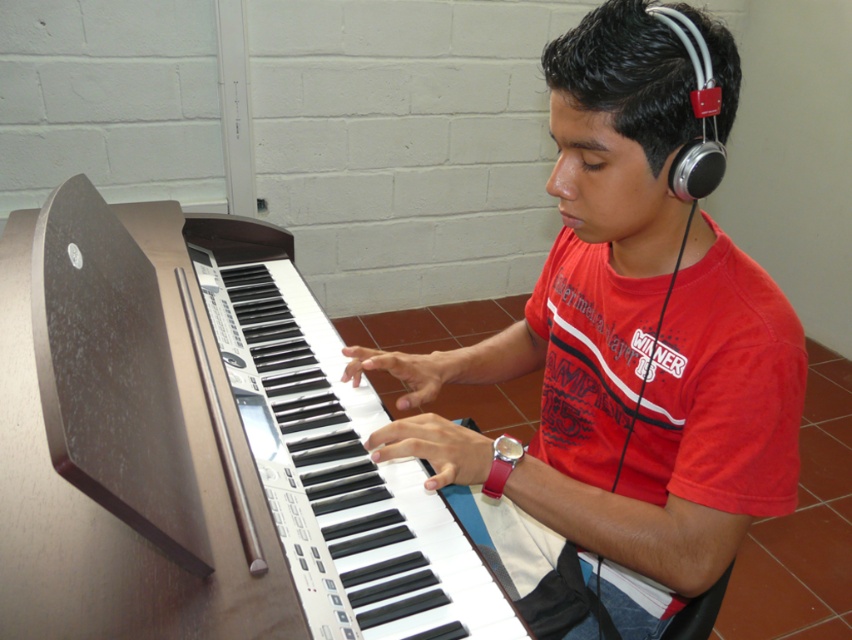
Question: Which of the following is the farthest from the observer?

Choices:
 (A) matte black keyboard at center
 (B) brown polished piano at center

Answer: (A)

Question: Does brown polished piano at center have a lesser width compared to matte black keyboard at center?

Choices:
 (A) yes
 (B) no

Answer: (B)

Question: Which of the following is the closest to the observer?

Choices:
 (A) brown polished piano at center
 (B) matte black keyboard at center

Answer: (A)

Question: Which point is closer to the camera?

Choices:
 (A) matte black keyboard at center
 (B) brown polished piano at center

Answer: (B)

Question: Does brown polished piano at center appear on the right side of matte black keyboard at center?

Choices:
 (A) no
 (B) yes

Answer: (A)

Question: From the image, what is the correct spatial relationship of brown polished piano at center in relation to matte black keyboard at center?

Choices:
 (A) left
 (B) right

Answer: (A)